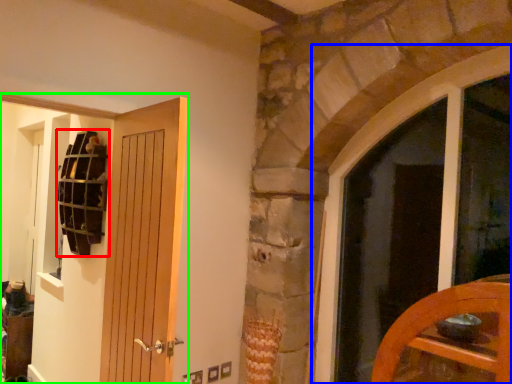
Question: Considering the real-world distances, which object is farthest from shelf (highlighted by a red box)? window (highlighted by a blue box) or door (highlighted by a green box)?

Choices:
 (A) window
 (B) door

Answer: (A)